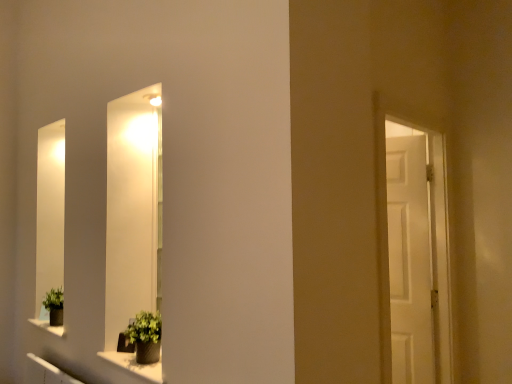
Question: From the image's perspective, does green matte plant pot at lower left, positioned as the 2th houseplant in back-to-front order, appear lower than green matte plant at lower left, the 1th houseplant when ordered from back to front?

Choices:
 (A) no
 (B) yes

Answer: (A)

Question: Is the surface of green matte plant pot at lower left, arranged as the 1th houseplant when viewed from the front, in direct contact with green matte plant at lower left, which is counted as the first houseplant, starting from the left?

Choices:
 (A) yes
 (B) no

Answer: (B)

Question: Can you confirm if green matte plant pot at lower left, which ranks as the 1th houseplant in right-to-left order, is bigger than green matte plant at lower left, arranged as the 2th houseplant when viewed from the front?

Choices:
 (A) yes
 (B) no

Answer: (A)

Question: Is green matte plant pot at lower left, arranged as the 1th houseplant when viewed from the front, facing away from green matte plant at lower left, the second houseplant viewed from the right?

Choices:
 (A) yes
 (B) no

Answer: (B)

Question: From a real-world perspective, is green matte plant pot at lower left, the 2th houseplant when ordered from left to right, over green matte plant at lower left, the 1th houseplant when ordered from back to front?

Choices:
 (A) no
 (B) yes

Answer: (B)

Question: Considering the relative sizes of green matte plant pot at lower left, the 2th houseplant when ordered from left to right, and green matte plant at lower left, which is counted as the first houseplant, starting from the left, in the image provided, is green matte plant pot at lower left, the 2th houseplant when ordered from left to right, taller than green matte plant at lower left, which is counted as the first houseplant, starting from the left,?

Choices:
 (A) yes
 (B) no

Answer: (A)

Question: Considering the relative sizes of green matte plant at lower left, which is counted as the first houseplant, starting from the left, and matte gray stone window sill at lower center in the image provided, is green matte plant at lower left, which is counted as the first houseplant, starting from the left, shorter than matte gray stone window sill at lower center?

Choices:
 (A) yes
 (B) no

Answer: (B)

Question: Is green matte plant at lower left, arranged as the 2th houseplant when viewed from the front, positioned before matte gray stone window sill at lower center?

Choices:
 (A) yes
 (B) no

Answer: (B)

Question: Is green matte plant at lower left, which is counted as the first houseplant, starting from the left, positioned with its back to matte gray stone window sill at lower center?

Choices:
 (A) no
 (B) yes

Answer: (A)

Question: Would you consider green matte plant at lower left, which is counted as the first houseplant, starting from the left, to be distant from matte gray stone window sill at lower center?

Choices:
 (A) no
 (B) yes

Answer: (A)

Question: From the image's perspective, is green matte plant at lower left, the 1th houseplant when ordered from back to front, above matte gray stone window sill at lower center?

Choices:
 (A) no
 (B) yes

Answer: (B)

Question: Can you confirm if green matte plant at lower left, the second houseplant viewed from the right, is wider than matte gray stone window sill at lower center?

Choices:
 (A) no
 (B) yes

Answer: (B)

Question: Is matte gray stone window sill at lower center bigger than green matte plant pot at lower left, which ranks as the 1th houseplant in right-to-left order?

Choices:
 (A) yes
 (B) no

Answer: (B)